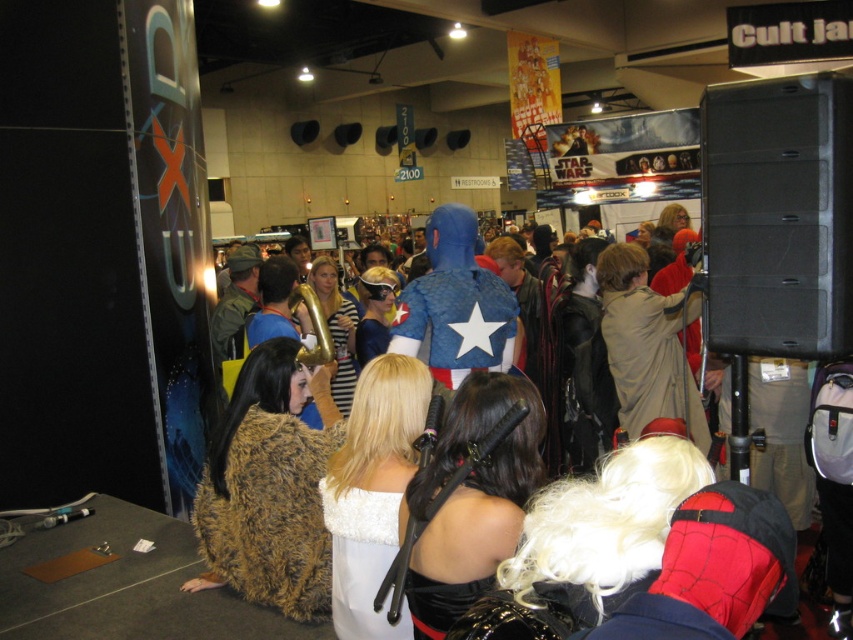
Does fuzzy brown coat at lower left have a lesser width compared to furry costume at center?

No.

What do you see at coordinates (270, 513) in the screenshot? The width and height of the screenshot is (853, 640). I see `fuzzy brown coat at lower left` at bounding box center [270, 513].

Identify the location of fuzzy brown coat at lower left. (270, 513).

Can you confirm if furry costume at center is positioned below white furry dress at center?

No.

What do you see at coordinates (444, 336) in the screenshot?
I see `furry costume at center` at bounding box center [444, 336].

What do you see at coordinates (444, 336) in the screenshot? I see `furry costume at center` at bounding box center [444, 336].

Where is `furry costume at center`? furry costume at center is located at coordinates (444, 336).

Is black leather gloves at center bigger than furry costume at center?

No.

Is black leather gloves at center thinner than furry costume at center?

Yes, black leather gloves at center is thinner than furry costume at center.

Who is more distant from viewer, [419,577] or [445,220]?

The point [445,220] is more distant.

This screenshot has width=853, height=640. In order to click on black leather gloves at center in this screenshot , I will do `click(469, 499)`.